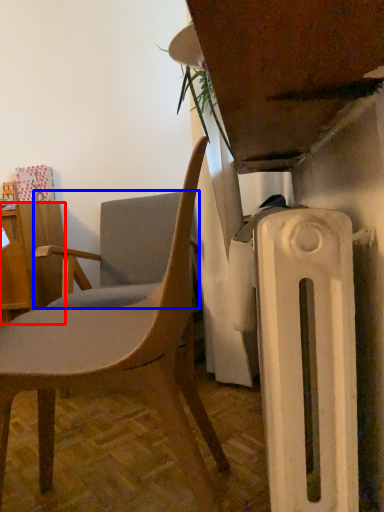
Question: Which point is closer to the camera, desk (highlighted by a red box) or chair (highlighted by a blue box)?

Choices:
 (A) desk
 (B) chair

Answer: (B)